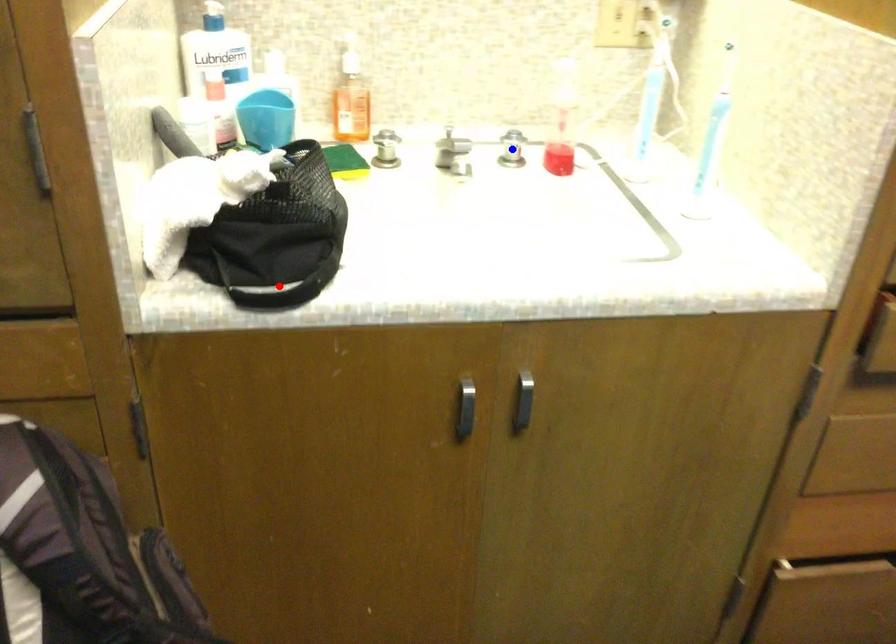
Question: Which of the two points in the image is closer to the camera?

Choices:
 (A) Blue point is closer.
 (B) Red point is closer.

Answer: (B)